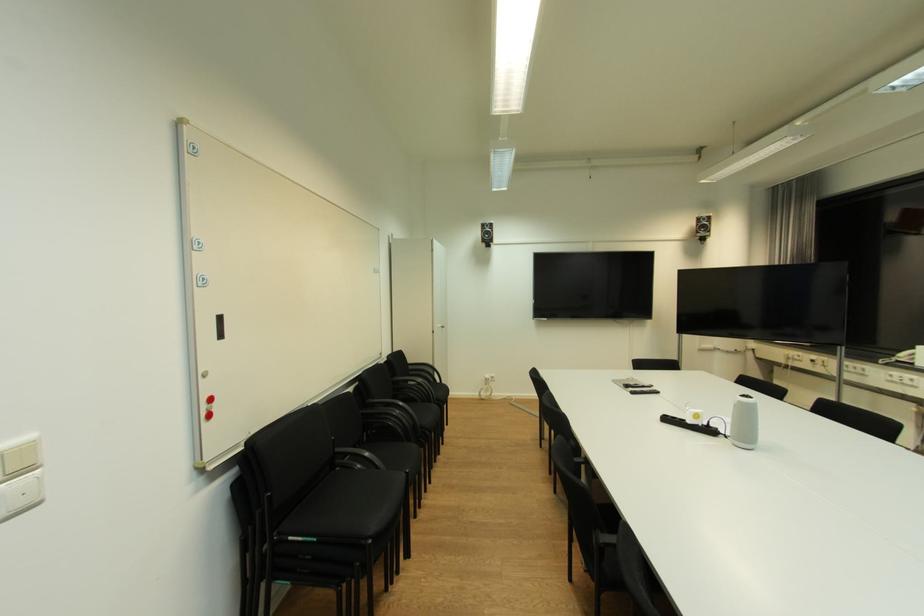
Which object does [689,426] point to?

It corresponds to the black power hub in the image.